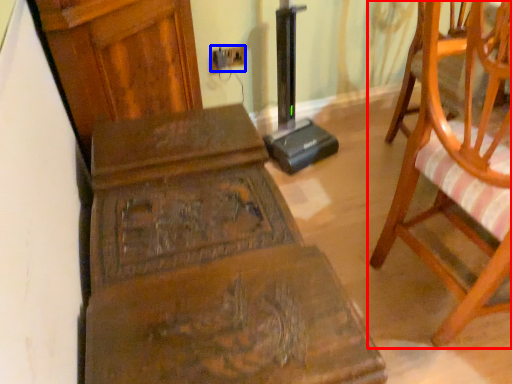
Question: Which object appears closest to the camera in this image, chair (highlighted by a red box) or electric outlet (highlighted by a blue box)?

Choices:
 (A) chair
 (B) electric outlet

Answer: (A)